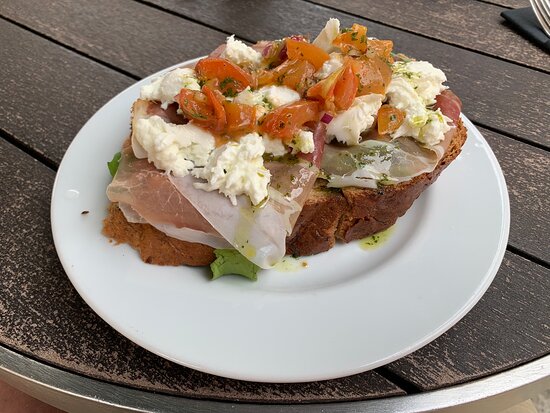
Image resolution: width=550 pixels, height=413 pixels. Find the location of `table`. table is located at coordinates (x=53, y=319).